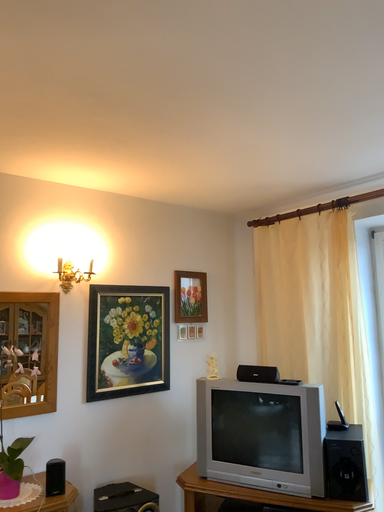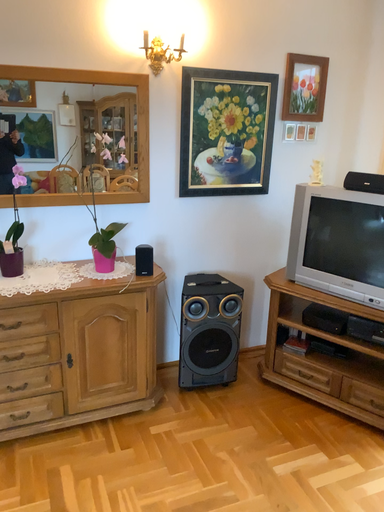
Question: How did the camera likely rotate when shooting the video?

Choices:
 (A) rotated left
 (B) rotated right

Answer: (A)